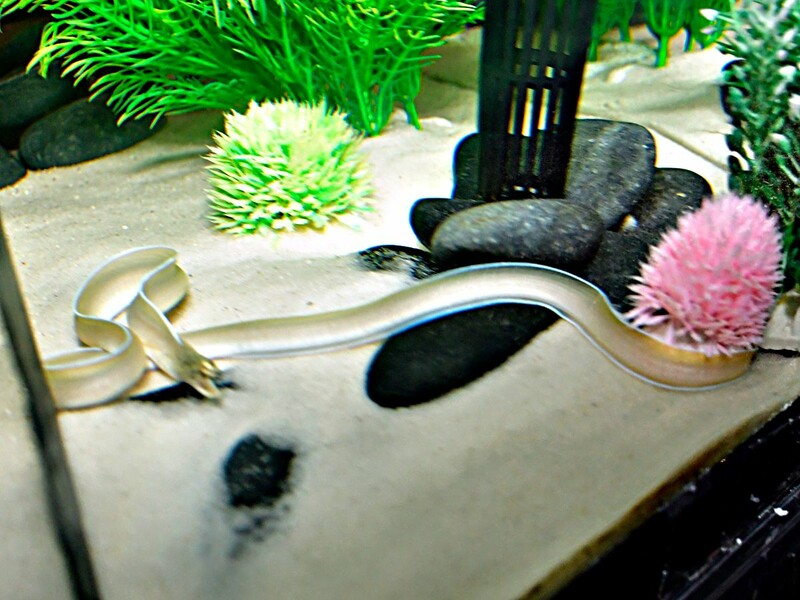
Image resolution: width=800 pixels, height=600 pixels. I want to click on short stubby pink fake aquarium plant, so click(710, 297).